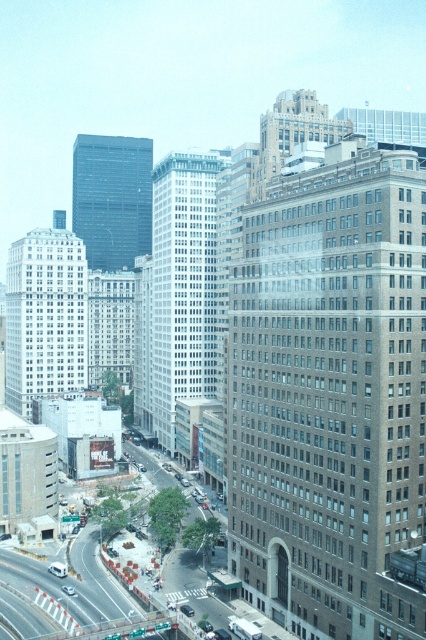
You are a delivery person driving a truck that is 6 meters long. You need to turn around your truck in the space between the white matte van at lower left and the silver metallic sedan at center. Is there enough space for the truck to make a U turn?

The distance between the white matte van at lower left and the silver metallic sedan at center is 5.95 meters. Since the truck is 6 meters long, there is not enough space to make a U turn.

From the picture: You are a pedestrian standing at the crosswalk near the white matte van at lower left and the silver metallic sedan at center. Which vehicle is closer to you?

The white matte van at lower left is closer to you because the silver metallic sedan at center is behind it.